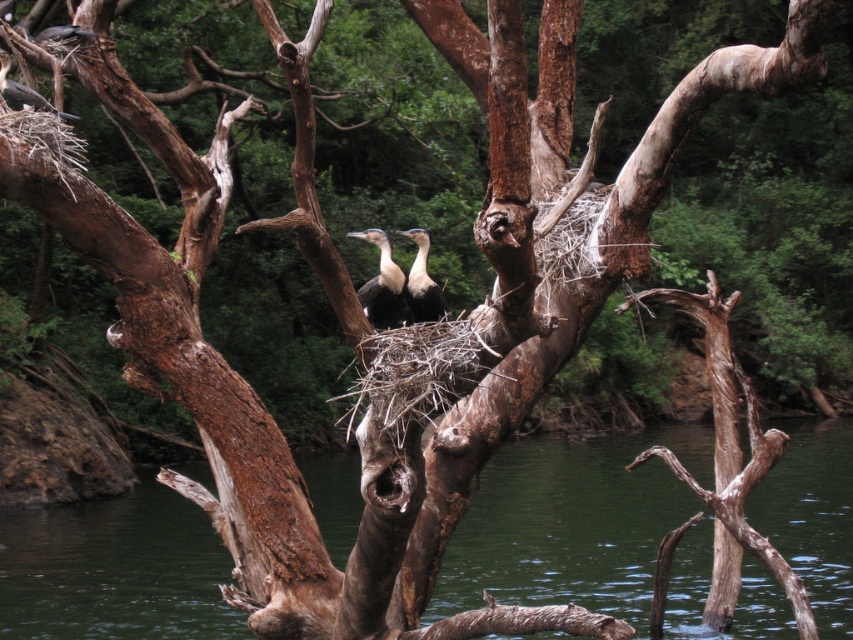
You are a birdwatcher observing the scene. You notice the white glossy birds at center and the matte black bird at upper left. Which bird is closer to the water surface?

The white glossy birds at center are closer to the water surface because they are positioned under the matte black bird at upper left, indicating a lower position in the scene.

You are a birdwatcher observing the scene. You notice two birds in the nest. One is a white glossy bird at center and the other is white glossy birds at center. Which of the two birds is taller?

The white glossy bird at center is taller than the white glossy birds at center.

You are observing a tree with a nest and two birds. The birds are the white glossy bird at center and the matte black bird at upper left. Which bird is positioned lower in the scene?

The white glossy bird at center is positioned lower than the matte black bird at upper left.